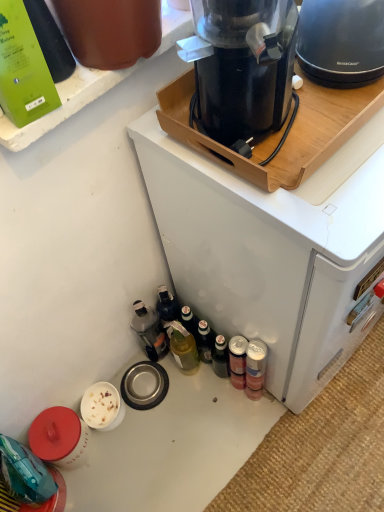
The width and height of the screenshot is (384, 512). Identify the location of vacant area to the right of metallic silver can at lower right, the 1th bottle viewed from the right. (319, 409).